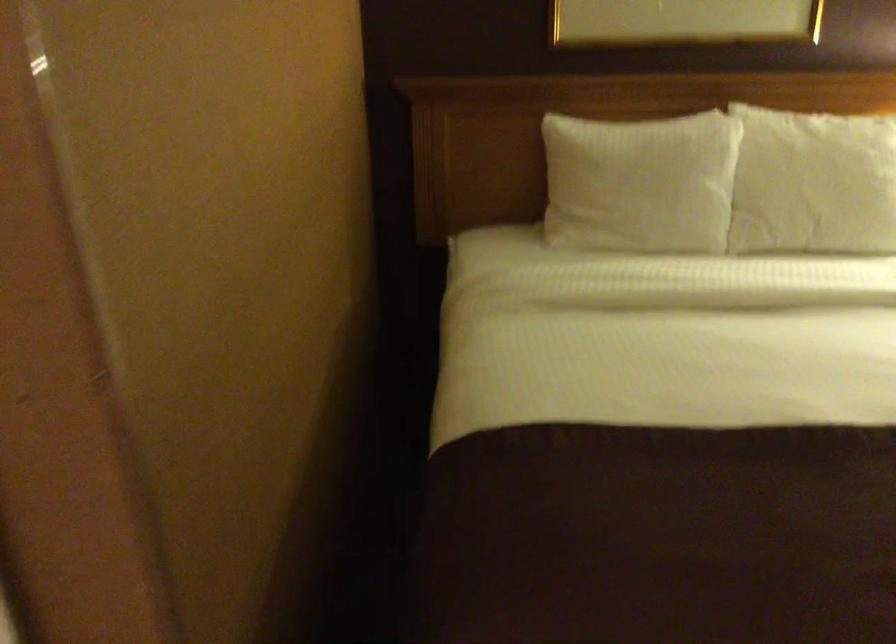
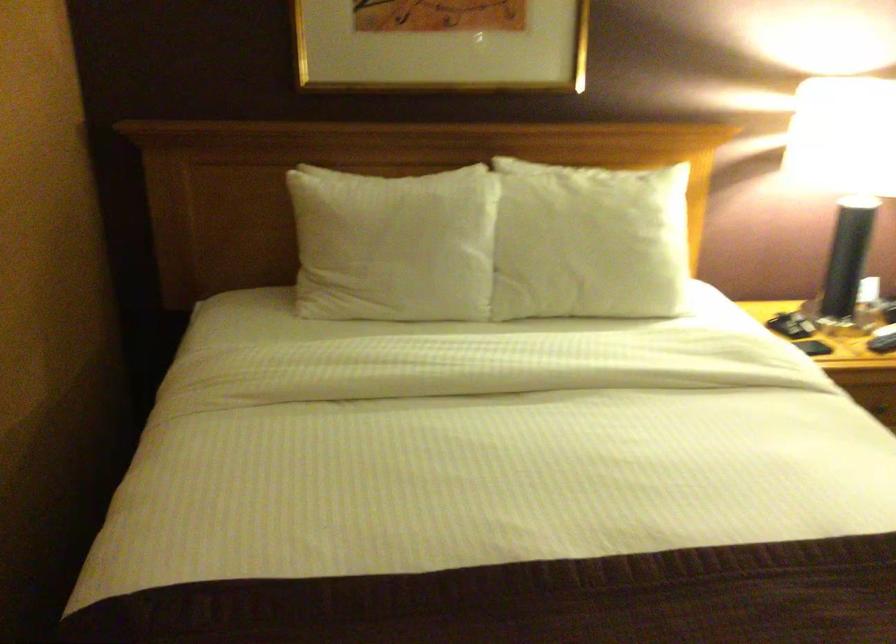
Where in the second image is the point corresponding to [640,182] from the first image?

(393, 245)